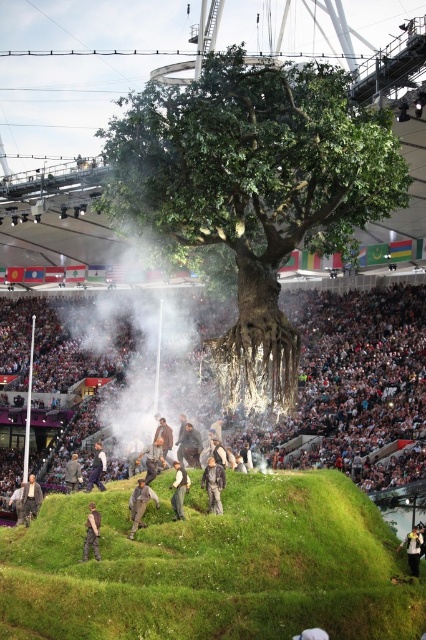
You are standing at the entrance of the stadium and want to locate the smooth skin crowd at center. According to the coordinates provided, in which direction should you look to find them?

The smooth skin crowd at center is located at coordinates point (359, 387), which means you should look towards the lower right direction from your current position at the entrance to find them.

You are a photographer trying to capture the crowd in the scene. Since the smooth skin crowd at center and the camouflage pants at center are both in the frame, which one is closer to the camera?

The smooth skin crowd at center is positioned over camouflage pants at center, meaning it is closer to the camera.

From the picture: You are an event organizer planning to place a large banner between the smooth skin crowd at center and the camouflage pants at center. Based on their widths, which side should the banner lean towards to ensure it doesn

The smooth skin crowd at center is wider than the camouflage pants at center. Therefore, the banner should lean towards the camouflage pants at center side to balance the width difference.